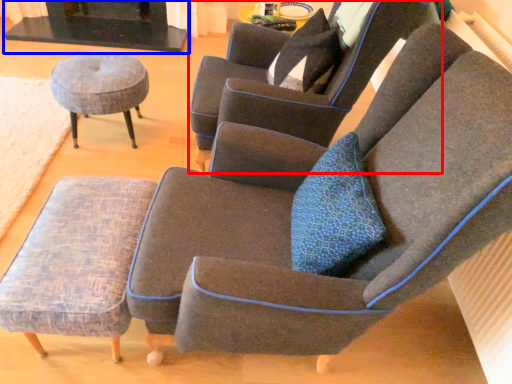
Question: Which object is further to the camera taking this photo, chair (highlighted by a red box) or fireplace (highlighted by a blue box)?

Choices:
 (A) chair
 (B) fireplace

Answer: (B)